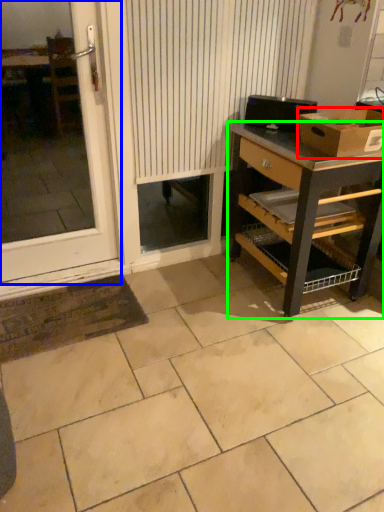
Question: Considering the real-world distances, which object is farthest from box (highlighted by a red box)? window (highlighted by a blue box) or desk (highlighted by a green box)?

Choices:
 (A) window
 (B) desk

Answer: (A)